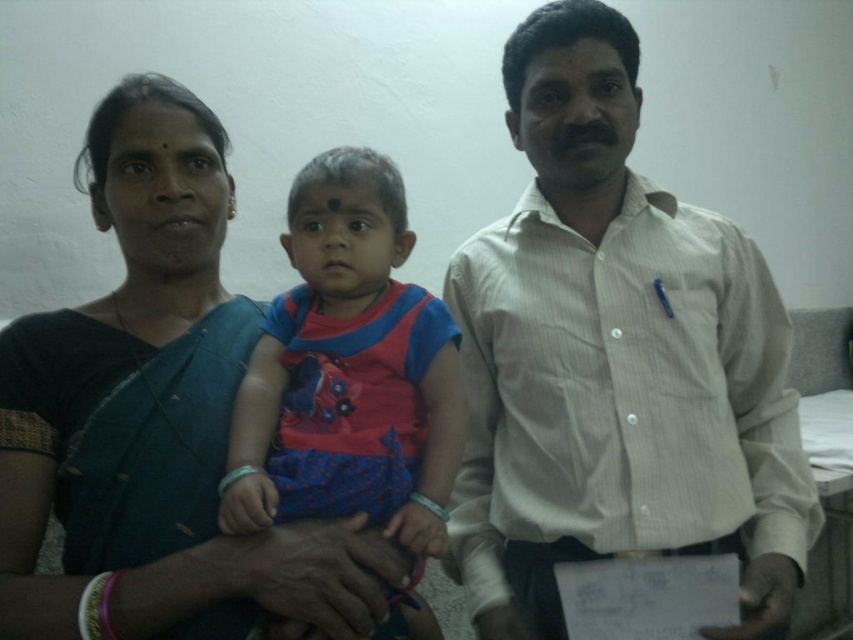
Does white striped shirt at center have a lesser width compared to dark blue sari at center?

No, white striped shirt at center is not thinner than dark blue sari at center.

Does white striped shirt at center appear over dark blue sari at center?

Correct, white striped shirt at center is located above dark blue sari at center.

From the picture: Who is more forward, (641, 547) or (152, 116)?

Point (641, 547) is in front.

Locate an element on the screen. The width and height of the screenshot is (853, 640). white striped shirt at center is located at coordinates (614, 360).

Who is lower down, dark blue sari at center or matte pink fabric dress at center?

Positioned lower is dark blue sari at center.

Where is `dark blue sari at center`? The image size is (853, 640). dark blue sari at center is located at coordinates (157, 420).

Is white striped shirt at center taller than matte pink fabric dress at center?

Yes, white striped shirt at center is taller than matte pink fabric dress at center.

Is white striped shirt at center to the right of matte pink fabric dress at center from the viewer's perspective?

Correct, you'll find white striped shirt at center to the right of matte pink fabric dress at center.

Who is more forward, (x=508, y=328) or (x=334, y=342)?

Point (x=334, y=342) is more forward.

Where is `white striped shirt at center`? The width and height of the screenshot is (853, 640). white striped shirt at center is located at coordinates (614, 360).